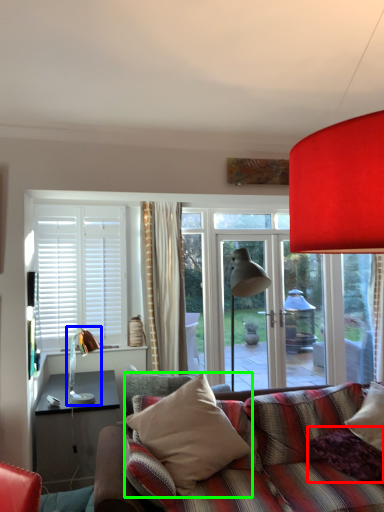
Question: Which is nearer to the pillow (highlighted by a red box)? table lamp (highlighted by a blue box) or pillow (highlighted by a green box).

Choices:
 (A) table lamp
 (B) pillow

Answer: (B)